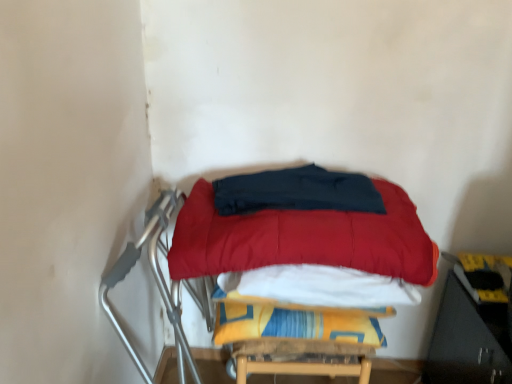
Find the location of a particular element. The width and height of the screenshot is (512, 384). vacant space situated above velvet red mattress at center (from a real-world perspective) is located at coordinates (298, 190).